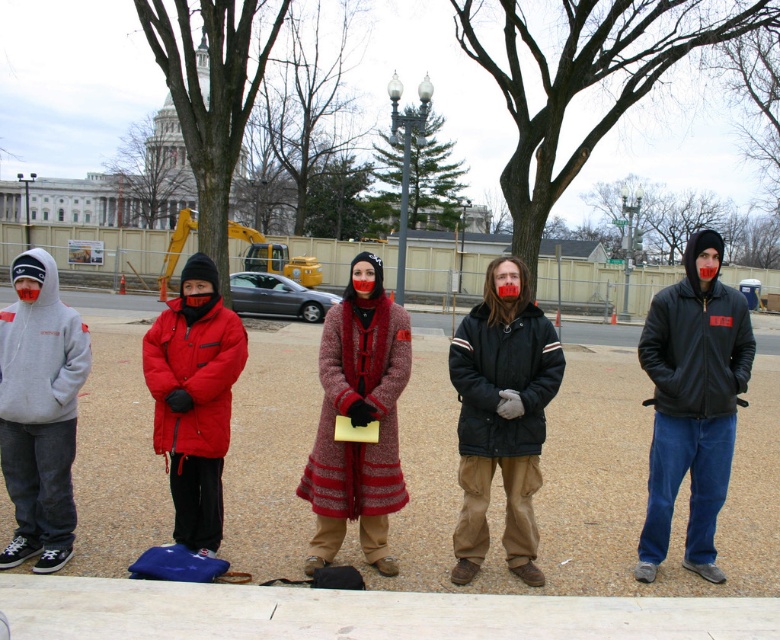
Based on the photo, you are a photographer trying to capture a wide shot of the protest scene. The concrete wall at center and the dark brown leather jacket at center are both in your frame. Considering their sizes, which object would appear wider in the photo?

The concrete wall at center appears wider in the photo because its width surpasses that of the dark brown leather jacket at center.

You are a photographer trying to capture a clear shot of the black leather jacket at center and the gray hoodie at left. Based on their positions, which one would appear closer to the bottom of the photo?

The black leather jacket at center is located below the gray hoodie at left, so it would appear closer to the bottom of the photo.

You are a photographer standing at the front of the group. You want to take a photo that includes both the point at (633,362) and the point at (534,307). Which point is closer to the camera?

The point at (534,307) is closer to the camera because it is less further than the point at (633,362).